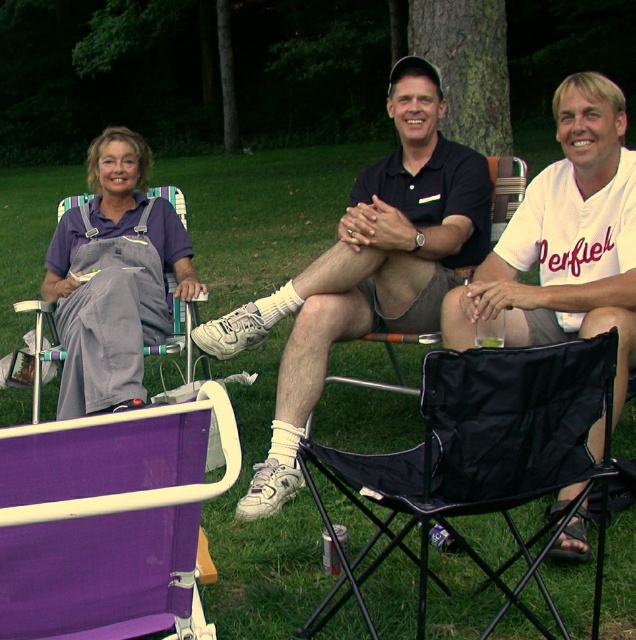
You are standing at the edge of the park and want to place a 25 inch wide picnic basket between the matte black polo shirt at center and the matte purple shirt at left. Will it fit without overlapping either?

The distance between the matte black polo shirt at center and the matte purple shirt at left is 24.99 inches. Since the picnic basket is 25 inches wide, it will not fit without overlapping them.

You are standing at the point labeled as point (522, 340) and want to walk to the point labeled as point (107, 518). Which direction should you move in to reach your destination?

You should move forward because point (107, 518) is in front of point (522, 340).